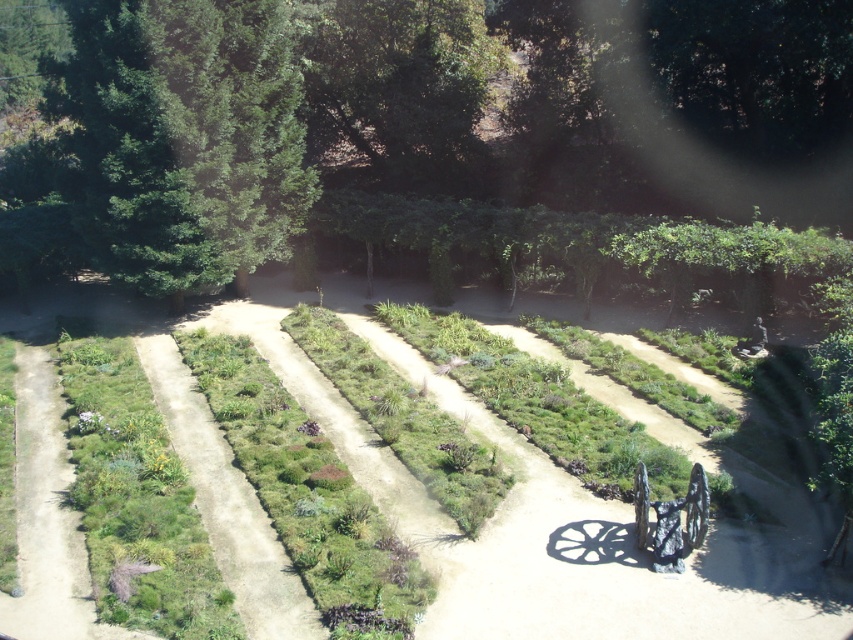
Question: Is green leafy tree at upper center in front of shiny metallic wagon at center?

Choices:
 (A) yes
 (B) no

Answer: (B)

Question: Which point is closer to the camera taking this photo?

Choices:
 (A) (660, 525)
 (B) (225, 83)
 (C) (84, 618)

Answer: (C)

Question: Which point is closer to the camera?

Choices:
 (A) green leafy tree at upper left
 (B) green grass at left
 (C) shiny metallic wagon at center
 (D) green leafy tree at upper center

Answer: (B)

Question: Is green leafy tree at upper center positioned in front of shiny metallic wagon at center?

Choices:
 (A) yes
 (B) no

Answer: (B)

Question: Where is green leafy tree at upper center located in relation to green leafy tree at upper left in the image?

Choices:
 (A) below
 (B) above

Answer: (B)

Question: Among these points, which one is farthest from the camera?

Choices:
 (A) (68, 84)
 (B) (651, 140)
 (C) (62, 618)

Answer: (B)